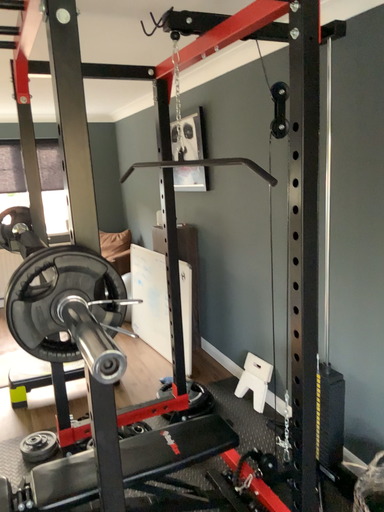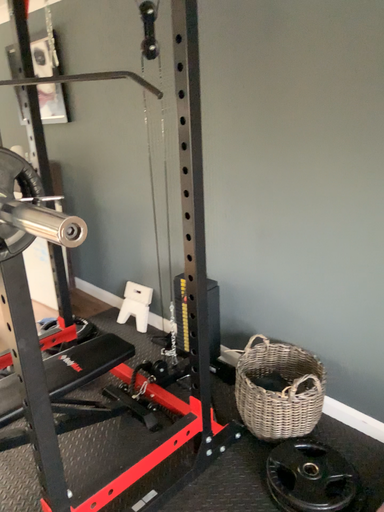
Question: How did the camera likely rotate when shooting the video?

Choices:
 (A) rotated upward
 (B) rotated downward

Answer: (B)